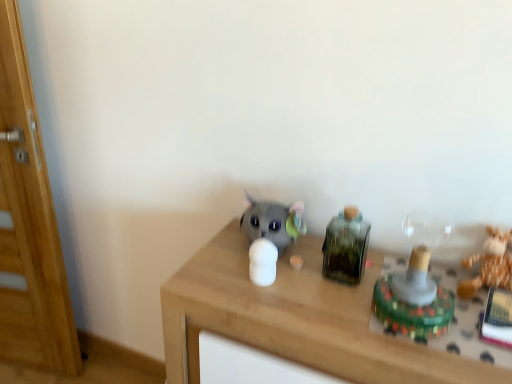
Find the location of `space that is in front of green glass bottle at center-right, arranged as the third toy when viewed from the right`. space that is in front of green glass bottle at center-right, arranged as the third toy when viewed from the right is located at coordinates (337, 311).